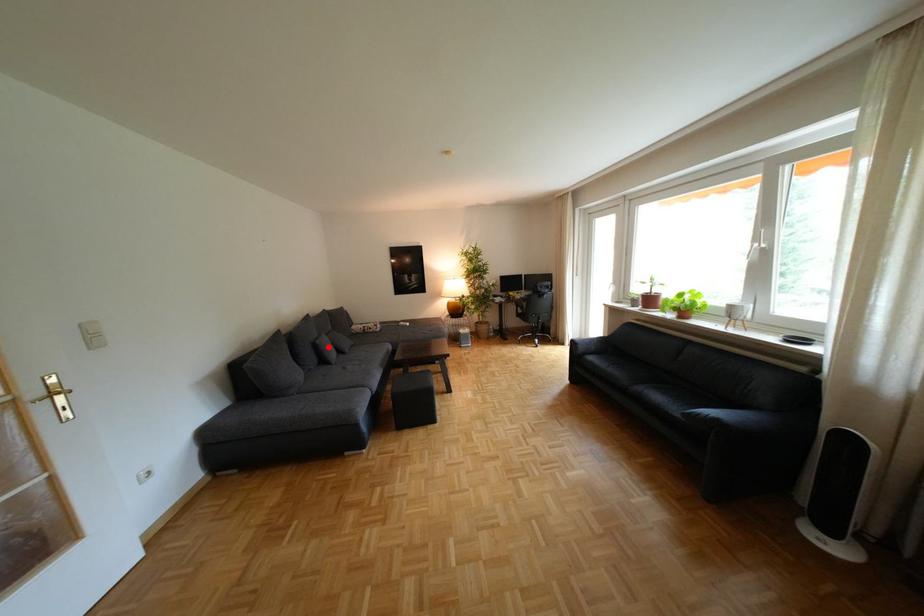
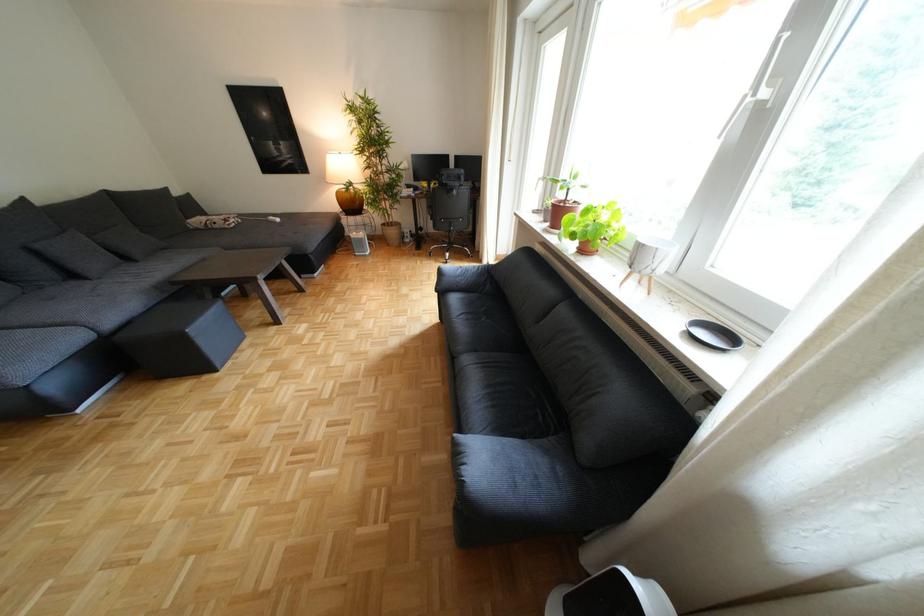
The point at the highlighted location is marked in the first image. Where is the corresponding point in the second image?

(49, 253)